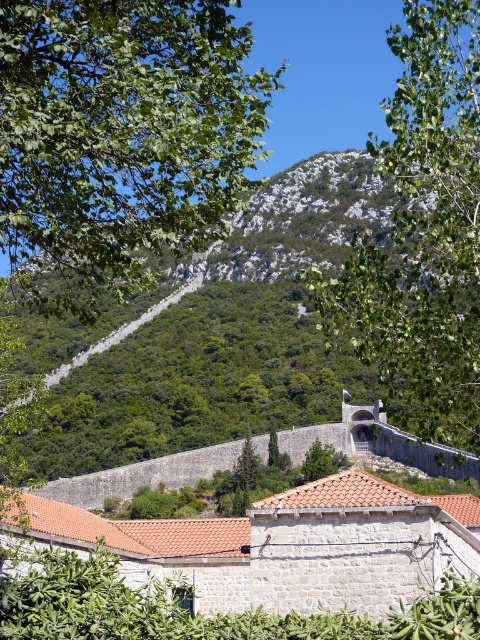
Question: Observing the image, what is the correct spatial positioning of green leafy tree at upper center in reference to green leafy tree at center?

Choices:
 (A) right
 (B) left

Answer: (A)

Question: Which point is farther from the camera taking this photo?

Choices:
 (A) pos(437,211)
 (B) pos(305,481)
 (C) pos(152,154)

Answer: (B)

Question: Which point appears closest to the camera in this image?

Choices:
 (A) click(x=126, y=412)
 (B) click(x=33, y=4)
 (C) click(x=316, y=458)
 (D) click(x=374, y=330)

Answer: (B)

Question: Is green leafy tree at upper left smaller than green leafy mountain at center?

Choices:
 (A) yes
 (B) no

Answer: (A)

Question: Can you confirm if green leafy tree at upper left is smaller than green leafy mountain at center?

Choices:
 (A) yes
 (B) no

Answer: (A)

Question: Which of the following is the farthest from the observer?

Choices:
 (A) green leafy tree at center
 (B) green leafy tree at upper center
 (C) green leafy mountain at center

Answer: (A)